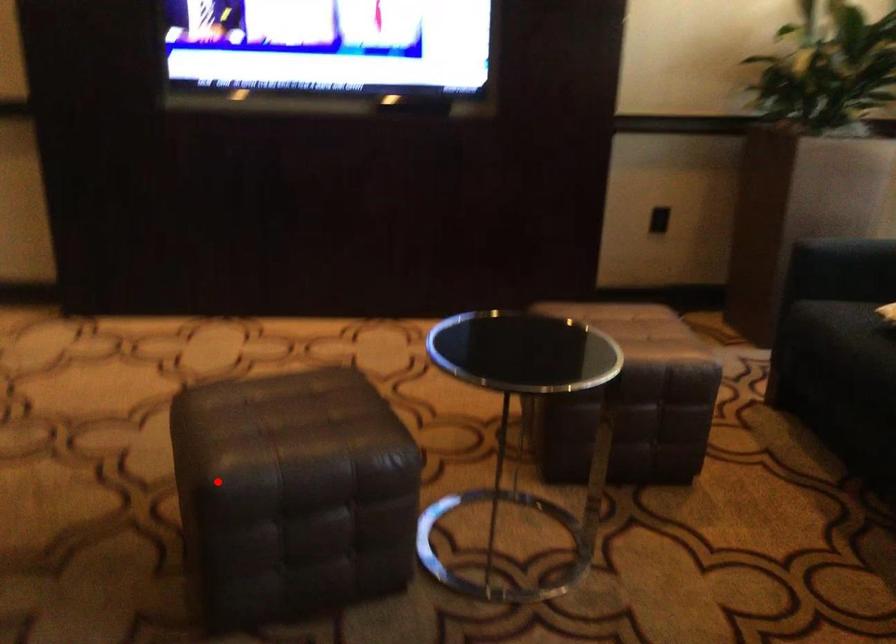
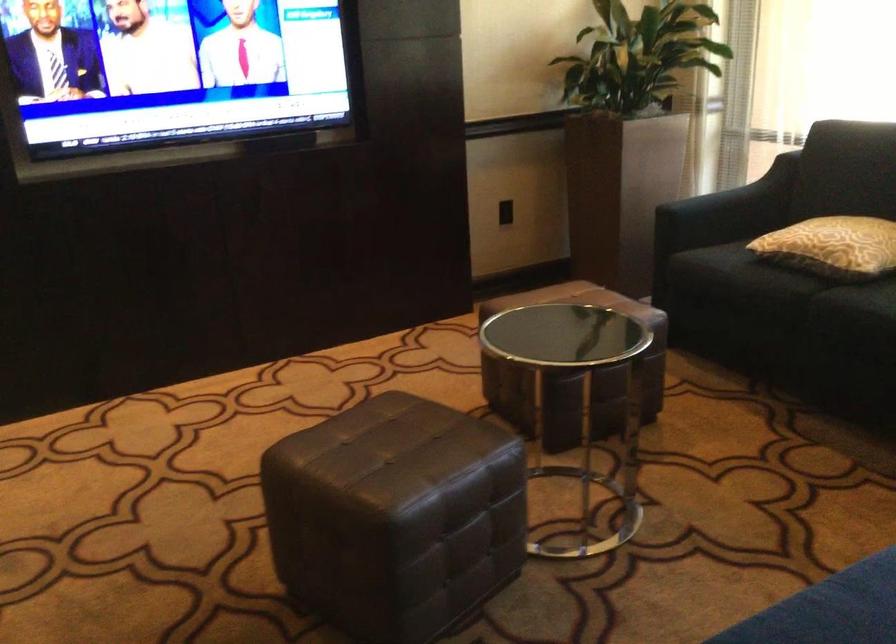
In the second image, find the point that corresponds to the highlighted location in the first image.

(394, 516)